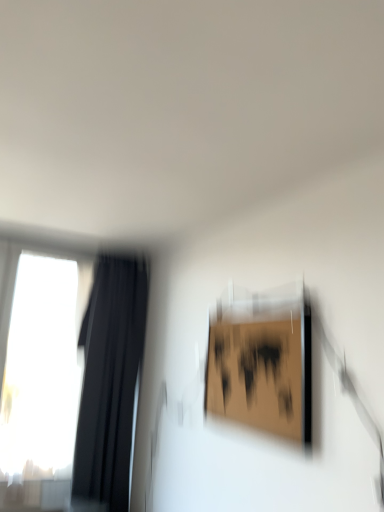
This screenshot has width=384, height=512. What do you see at coordinates (94, 353) in the screenshot?
I see `transparent glass window at left` at bounding box center [94, 353].

The width and height of the screenshot is (384, 512). Identify the location of wooden frame at upper right. (262, 364).

The image size is (384, 512). What do you see at coordinates (262, 364) in the screenshot? I see `wooden frame at upper right` at bounding box center [262, 364].

Measure the distance between point (130,261) and camera.

Point (130,261) and camera are 10.18 feet apart from each other.

Where is `transparent glass window at left`? transparent glass window at left is located at coordinates (94, 353).

Is black fabric curtain at left not close to transparent glass window at left?

No, there isn't a large distance between black fabric curtain at left and transparent glass window at left.

Is black fabric curtain at left positioned with its back to transparent glass window at left?

No, black fabric curtain at left is not facing the opposite direction of transparent glass window at left.

Who is bigger, black fabric curtain at left or transparent glass window at left?

With larger size is black fabric curtain at left.

Does black fabric curtain at left have a greater height compared to transparent glass window at left?

Correct, black fabric curtain at left is much taller as transparent glass window at left.

Is wooden frame at upper right aimed at transparent glass window at left?

No, wooden frame at upper right is not oriented towards transparent glass window at left.

Looking at this image, is wooden frame at upper right bigger than transparent glass window at left?

Actually, wooden frame at upper right might be smaller than transparent glass window at left.

From a real-world perspective, between wooden frame at upper right and transparent glass window at left, who is vertically lower?

From a 3D spatial view, transparent glass window at left is below.

Which object is positioned more to the right, wooden frame at upper right or transparent glass window at left?

Positioned to the right is wooden frame at upper right.

Does point (286, 389) come behind point (108, 398)?

No.

Is wooden frame at upper right wider than black fabric curtain at left?

In fact, wooden frame at upper right might be narrower than black fabric curtain at left.

In the scene shown: Between wooden frame at upper right and black fabric curtain at left, which one has less height?

Standing shorter between the two is wooden frame at upper right.

Relative to black fabric curtain at left, is wooden frame at upper right in front or behind?

wooden frame at upper right is positioned closer to the viewer than black fabric curtain at left.

Is black fabric curtain at left facing towards wooden frame at upper right?

Yes, black fabric curtain at left is turned towards wooden frame at upper right.

Would you consider black fabric curtain at left to be distant from wooden frame at upper right?

black fabric curtain at left is far away from wooden frame at upper right.

Considering the relative sizes of black fabric curtain at left and wooden frame at upper right in the image provided, is black fabric curtain at left wider than wooden frame at upper right?

Yes, black fabric curtain at left is wider than wooden frame at upper right.

From the image's perspective, is transparent glass window at left on top of black fabric curtain at left?

Yes, from the image's perspective, transparent glass window at left is on top of black fabric curtain at left.

Could you tell me if transparent glass window at left is turned towards black fabric curtain at left?

Yes, transparent glass window at left faces towards black fabric curtain at left.

Are transparent glass window at left and black fabric curtain at left making contact?

Yes, transparent glass window at left is next to black fabric curtain at left.

Considering the sizes of objects transparent glass window at left and black fabric curtain at left in the image provided, who is taller, transparent glass window at left or black fabric curtain at left?

Standing taller between the two is black fabric curtain at left.

From a real-world perspective, who is located higher, transparent glass window at left or wooden frame at upper right?

wooden frame at upper right, from a real-world perspective.

Which is closer, (121, 325) or (266, 319)?

Point (121, 325) is farther from the camera than point (266, 319).

Does transparent glass window at left appear on the right side of wooden frame at upper right?

Incorrect, transparent glass window at left is not on the right side of wooden frame at upper right.

Based on their sizes in the image, would you say transparent glass window at left is bigger or smaller than wooden frame at upper right?

In the image, transparent glass window at left appears to be larger than wooden frame at upper right.

You are a GUI agent. You are given a task and a screenshot of the screen. Output one action in this format:
    pyautogui.click(x=<x>, y=<y>)
    Task: Click on the window above the black fabric curtain at left (from a real-world perspective)
    The image size is (384, 512).
    Given the screenshot: What is the action you would take?
    pyautogui.click(x=94, y=353)

Find the location of a particular element. Image resolution: width=384 pixels, height=512 pixels. window below the wooden frame at upper right (from a real-world perspective) is located at coordinates (94, 353).

From the picture: From the image, which object appears to be farther from black fabric curtain at left, wooden frame at upper right or transparent glass window at left?

wooden frame at upper right lies further to black fabric curtain at left than the other object.

Considering their positions, is transparent glass window at left positioned closer to black fabric curtain at left than wooden frame at upper right?

The object closer to black fabric curtain at left is transparent glass window at left.

Considering their positions, is transparent glass window at left positioned further to wooden frame at upper right than black fabric curtain at left?

Among the two, transparent glass window at left is located further to wooden frame at upper right.

Estimate the real-world distances between objects in this image. Which object is further from wooden frame at upper right, black fabric curtain at left or transparent glass window at left?

transparent glass window at left is positioned further to the anchor wooden frame at upper right.

From the image, which object appears to be farther from transparent glass window at left, black fabric curtain at left or wooden frame at upper right?

wooden frame at upper right.

When comparing their distances from transparent glass window at left, does wooden frame at upper right or black fabric curtain at left seem further?

Among the two, wooden frame at upper right is located further to transparent glass window at left.

The height and width of the screenshot is (512, 384). I want to click on curtain between transparent glass window at left and wooden frame at upper right in the horizontal direction, so click(x=109, y=382).